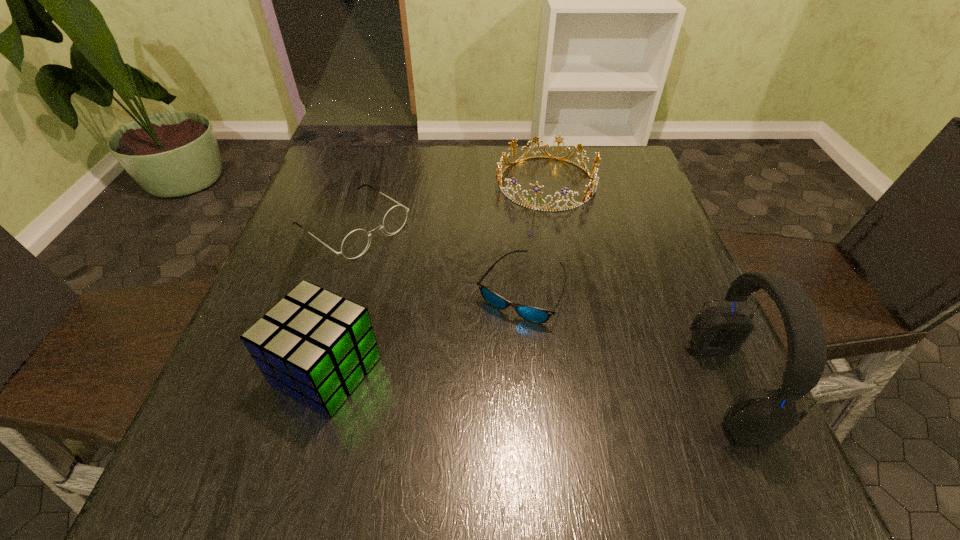
I want to click on free spot on the desktop that is between the fourth shortest object and the tallest object and is positioned on the front-facing side of the third tallest object, so click(x=466, y=376).

Locate an element on the screen. vacant space on the desktop that is between the cube and the headset and is positioned on the front-facing side of the fourth tallest object is located at coordinates (577, 381).

Where is `free space on the desktop that is between the cube and the headset and is positioned at the front of the sunglasses showing the lenses`? This screenshot has width=960, height=540. free space on the desktop that is between the cube and the headset and is positioned at the front of the sunglasses showing the lenses is located at coordinates (543, 379).